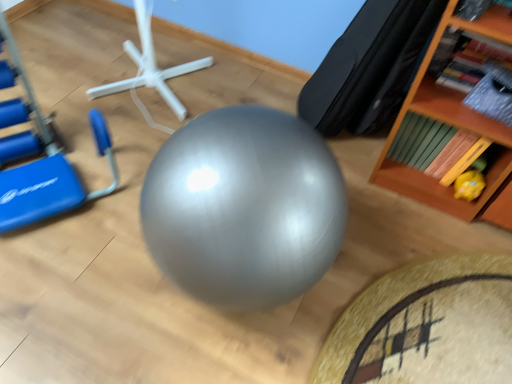
What are the coordinates of `vacant area situated below white plastic stand at center (from a real-world perspective)` in the screenshot? It's located at (150, 93).